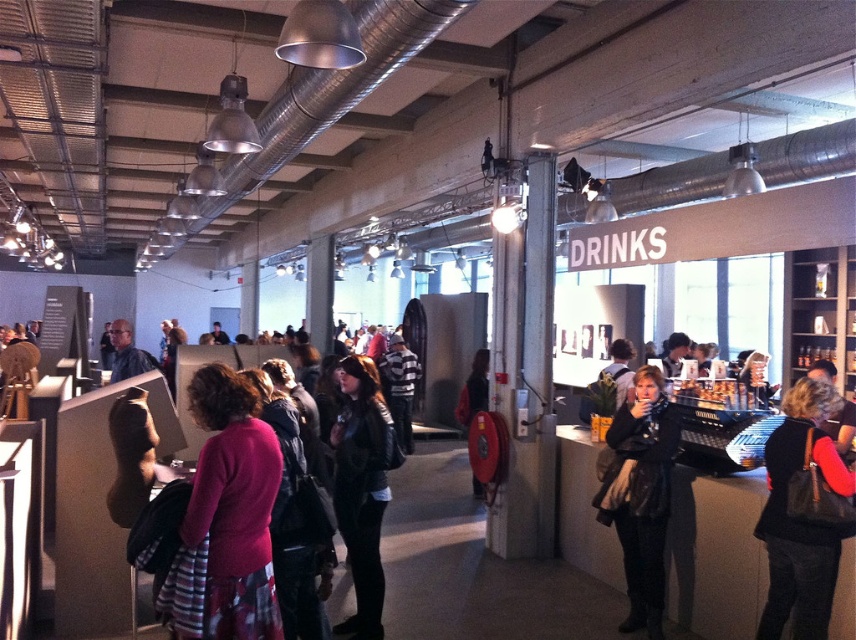
Question: Among these objects, which one is farthest from the camera?

Choices:
 (A) black leather jacket at center
 (B) leather jacket at center
 (C) matte black jacket at center
 (D) black leather handbag at lower right

Answer: (C)

Question: Is pink matte sweater at center smaller than black leather jacket at center?

Choices:
 (A) yes
 (B) no

Answer: (A)

Question: Which point is closer to the camera taking this photo?

Choices:
 (A) (378, 428)
 (B) (126, 355)
 (C) (660, 557)
 (D) (217, 609)

Answer: (D)

Question: Is leather jacket at center in front of matte black jacket at center?

Choices:
 (A) yes
 (B) no

Answer: (A)

Question: Which is farther from the black leather handbag at lower right?

Choices:
 (A) pink matte sweater at center
 (B) leather jacket at center

Answer: (A)

Question: Is black leather handbag at lower right thinner than leather jacket at center?

Choices:
 (A) no
 (B) yes

Answer: (B)